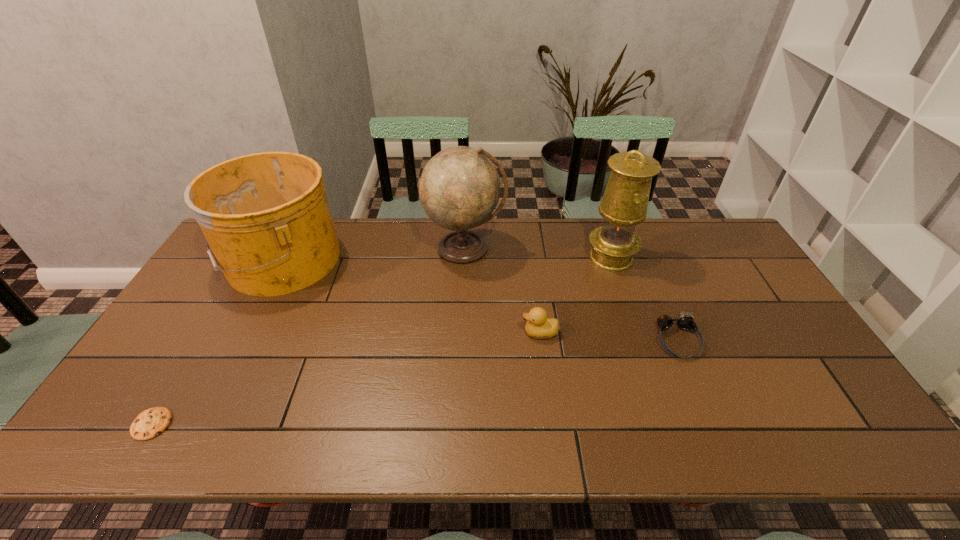
Image resolution: width=960 pixels, height=540 pixels. I want to click on free space that satisfies the following two spatial constraints: 1. facing forward on the third shortest object; 2. on the front side of the shortest object, so click(552, 424).

Locate an element on the screen. The height and width of the screenshot is (540, 960). free spot that satisfies the following two spatial constraints: 1. on the front-facing side of the third object from left to right; 2. on the right side of the oil lamp is located at coordinates (465, 258).

This screenshot has width=960, height=540. Find the location of `free region that satisfies the following two spatial constraints: 1. on the back side of the oil lamp; 2. on the right side of the bucket`. free region that satisfies the following two spatial constraints: 1. on the back side of the oil lamp; 2. on the right side of the bucket is located at coordinates (283, 258).